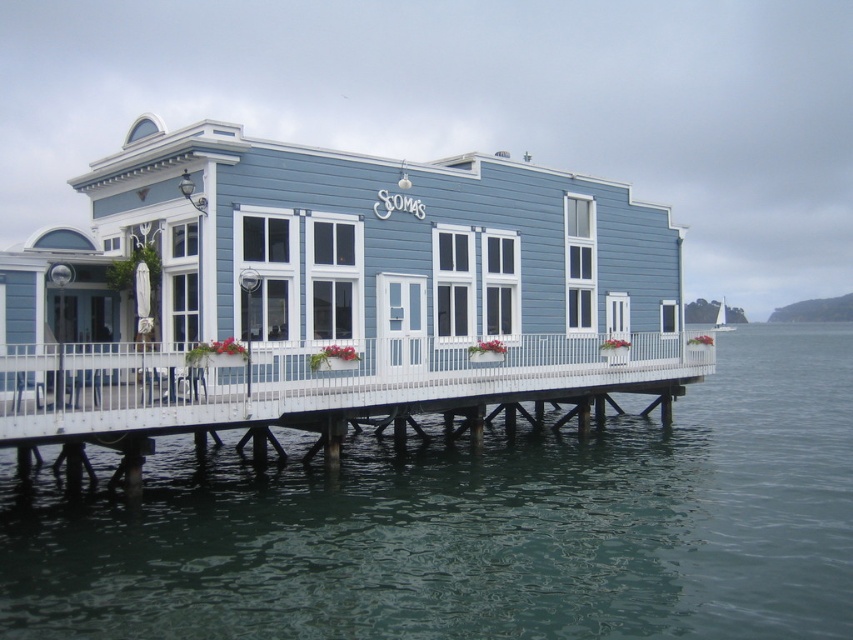
You are a visitor standing on the white wooden dock at lower center and want to see the transparent water at lower center. In which direction should you look relative to the dock?

The transparent water at lower center is in front of the white wooden dock at lower center, so you should look forward to see it.

You are a visitor standing at the entrance of Scoma and want to walk towards the transparent water at lower center. Which direction should you move relative to the white wooden dock at lower center?

To reach the transparent water at lower center, you should move to the right of the white wooden dock at lower center since the transparent water at lower center is positioned to the right of it.

You are standing at the entrance of Scoma and looking towards the flower boxes. There is a point marked at (479, 525). Is this point on the building or on the water?

The point is on transparent water at lower center, so it is on the water.